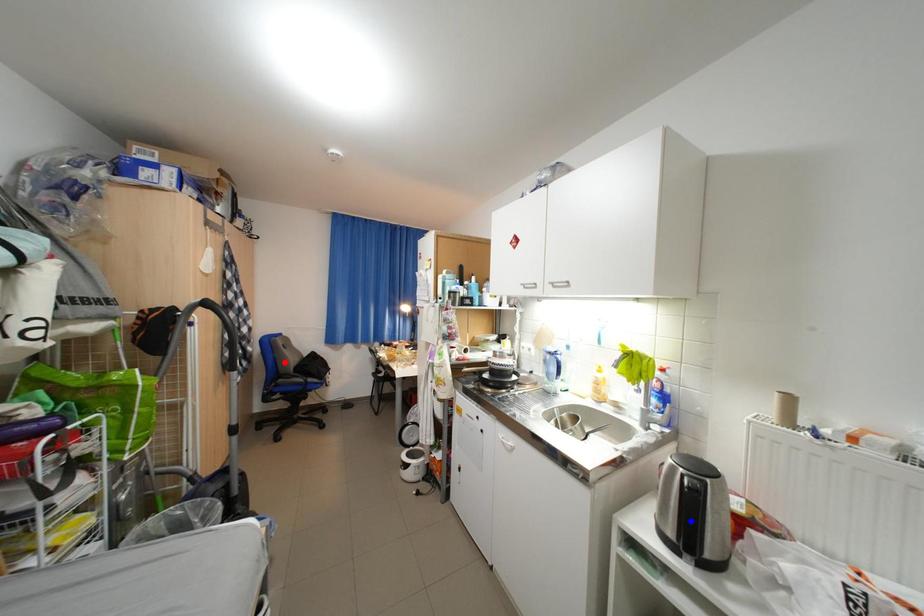
Question: In the image, two points are highlighted. Which point is nearer to the camera? Reply with the corresponding letter.

Choices:
 (A) blue point
 (B) red point

Answer: (A)